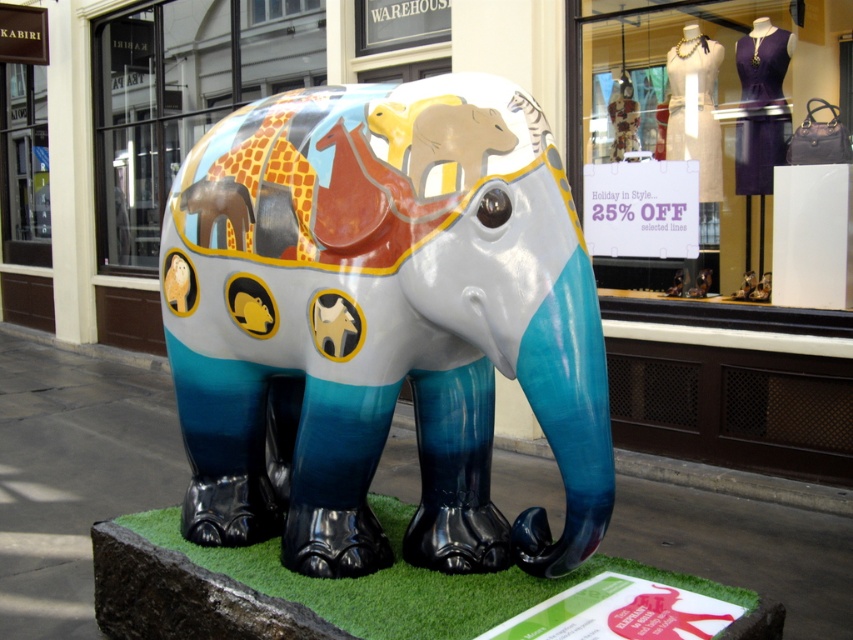
Question: Can you confirm if matte painted elephant at center is smaller than green artificial turf at lower center?

Choices:
 (A) yes
 (B) no

Answer: (B)

Question: Is matte painted elephant at center thinner than green artificial turf at lower center?

Choices:
 (A) no
 (B) yes

Answer: (B)

Question: Is shiny painted elephant at center wider than matte painted elephant at center?

Choices:
 (A) no
 (B) yes

Answer: (A)

Question: Which object is the farthest from the green artificial turf at lower center?

Choices:
 (A) shiny painted elephant at center
 (B) matte painted elephant at center

Answer: (B)

Question: Which object is the farthest from the green artificial turf at lower center?

Choices:
 (A) shiny painted elephant at center
 (B) matte painted elephant at center

Answer: (B)

Question: Among these objects, which one is nearest to the camera?

Choices:
 (A) matte painted elephant at center
 (B) green artificial turf at lower center

Answer: (B)